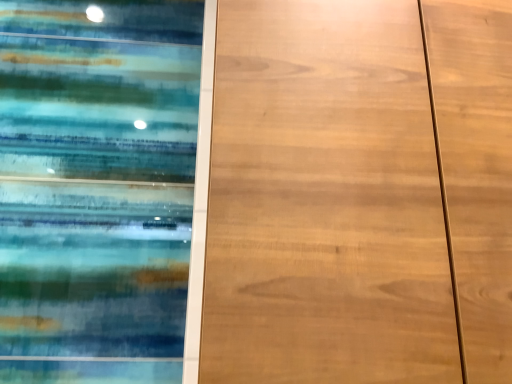
The width and height of the screenshot is (512, 384). What do you see at coordinates (359, 193) in the screenshot?
I see `light brown wood at center` at bounding box center [359, 193].

Where is `light brown wood at center`? The width and height of the screenshot is (512, 384). light brown wood at center is located at coordinates (359, 193).

In order to click on light brown wood at center in this screenshot , I will do `click(359, 193)`.